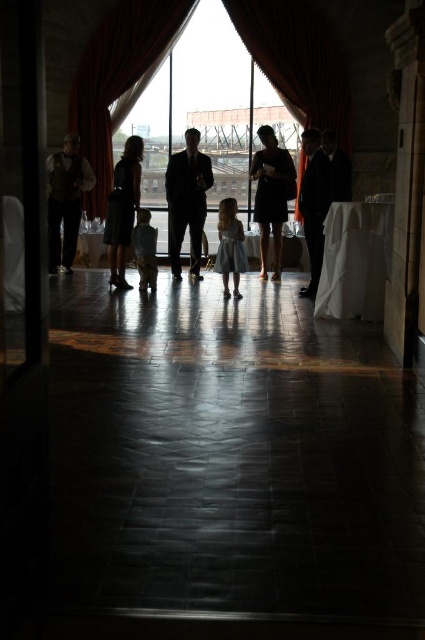
Question: Does silky red curtain at center have a greater width compared to silky black suit at center?

Choices:
 (A) no
 (B) yes

Answer: (B)

Question: Which object is closer to the camera taking this photo?

Choices:
 (A) matte gold vest at center
 (B) silky black suit at center
 (C) light brown fabric child at center

Answer: (C)

Question: Does silky black suit at center lie in front of matte black suit at right?

Choices:
 (A) yes
 (B) no

Answer: (B)

Question: Observing the image, what is the correct spatial positioning of transparent glass window at center in reference to light blue satin dress at center?

Choices:
 (A) left
 (B) right

Answer: (A)

Question: Which point is closer to the camera?

Choices:
 (A) (132, 68)
 (B) (305, 289)

Answer: (B)

Question: Among these points, which one is nearest to the camera?

Choices:
 (A) (99, 154)
 (B) (320, 72)
 (C) (291, 204)

Answer: (B)